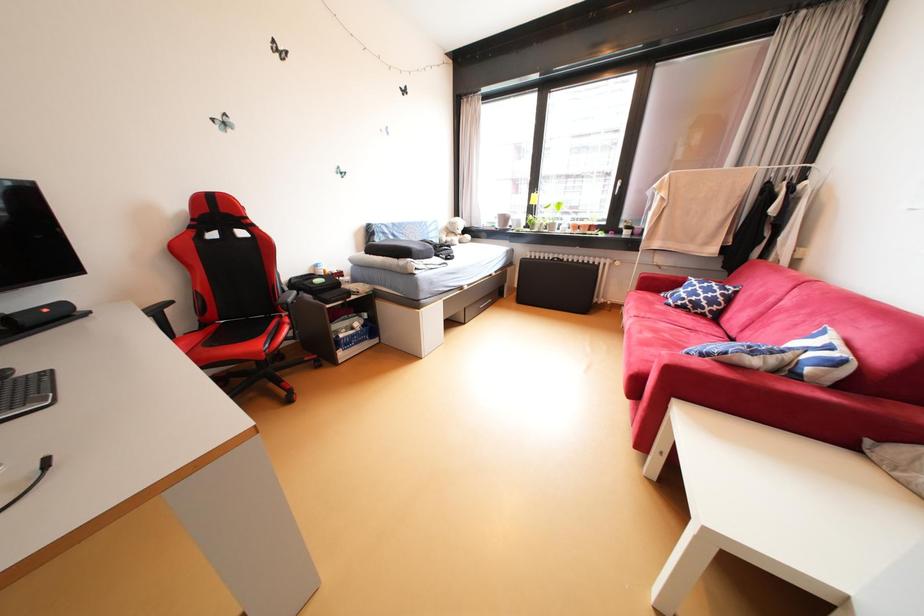
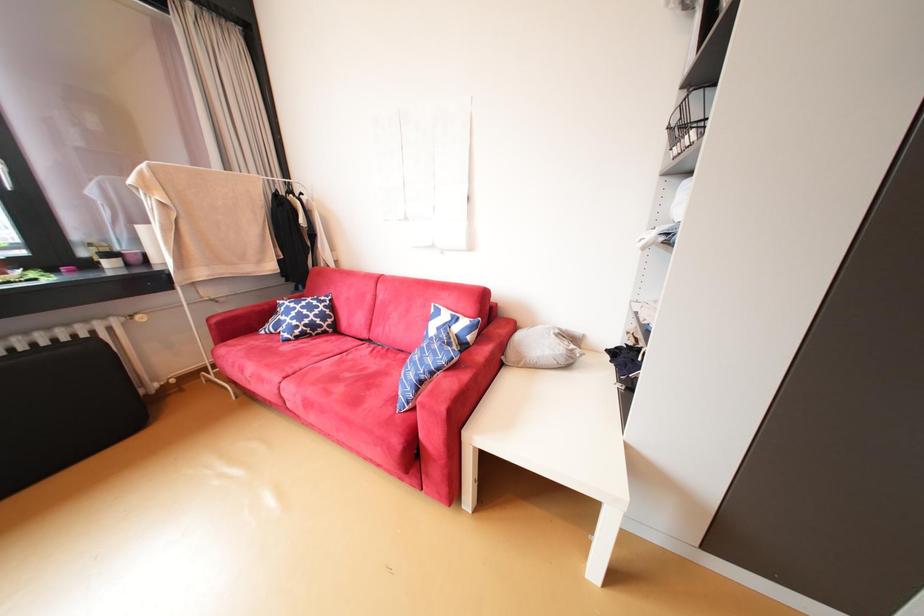
Based on the continuous images, in which direction is the camera rotating?

The rotation direction of the camera is right-down.